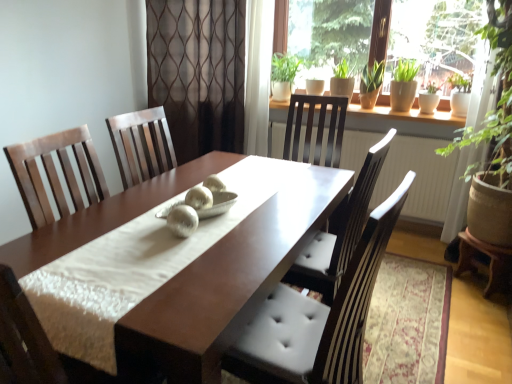
I want to click on vacant space situated above brown sheer curtain at center (from a real-world perspective), so click(203, 46).